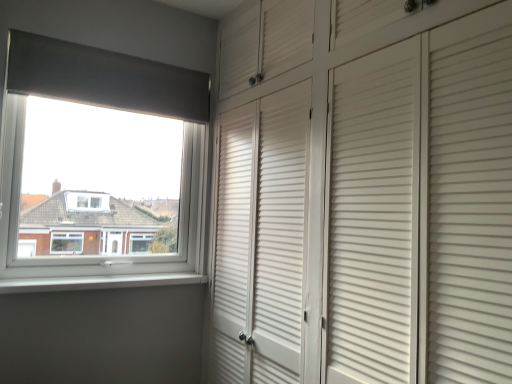
You are a GUI agent. You are given a task and a screenshot of the screen. Output one action in this format:
    pyautogui.click(x=<x>, y=<y>)
    Task: Click on the vacant region under white plastic window at upper left (from a real-world perspective)
    This screenshot has width=512, height=384.
    Given the screenshot: What is the action you would take?
    pyautogui.click(x=110, y=278)